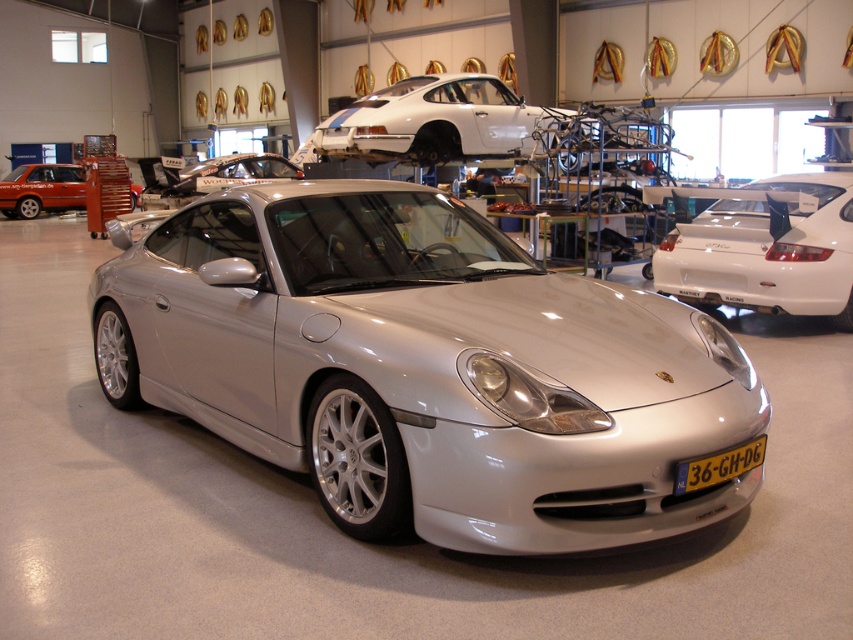
How much distance is there between matte orange van at left and yellow plastic license plate at center?

matte orange van at left and yellow plastic license plate at center are 79.89 feet apart.

Is matte orange van at left to the right of yellow plastic license plate at center from the viewer's perspective?

Incorrect, matte orange van at left is not on the right side of yellow plastic license plate at center.

The height and width of the screenshot is (640, 853). I want to click on matte orange van at left, so click(41, 189).

You are a GUI agent. You are given a task and a screenshot of the screen. Output one action in this format:
    pyautogui.click(x=<x>, y=<y>)
    Task: Click on the matte orange van at left
    Image resolution: width=853 pixels, height=640 pixels.
    Given the screenshot: What is the action you would take?
    pyautogui.click(x=41, y=189)

Does white matte car at upper center appear on the right side of satin silver spoiler at center?

Correct, you'll find white matte car at upper center to the right of satin silver spoiler at center.

Between point (418, 93) and point (186, 168), which one is positioned in front?

Point (418, 93) is more forward.

The height and width of the screenshot is (640, 853). I want to click on white matte car at upper center, so click(x=428, y=122).

Is white matte car at upper center positioned before yellow plastic license plate at center?

No, white matte car at upper center is behind yellow plastic license plate at center.

Between white matte car at upper center and yellow plastic license plate at center, which one appears on the right side from the viewer's perspective?

From the viewer's perspective, yellow plastic license plate at center appears more on the right side.

Who is more distant from viewer, [323,161] or [683,474]?

The point [323,161] is behind.

Identify the location of white matte car at upper center. The height and width of the screenshot is (640, 853). (428, 122).